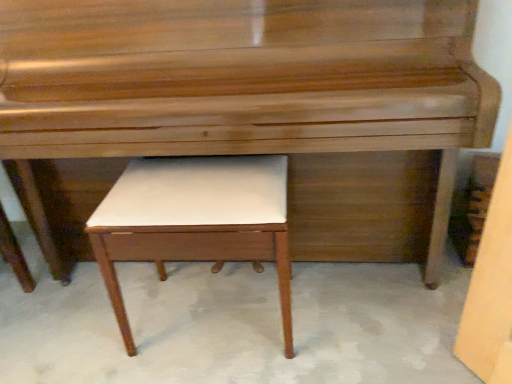
You are a GUI agent. You are given a task and a screenshot of the screen. Output one action in this format:
    pyautogui.click(x=<x>, y=<y>)
    Task: Click on the vacant area that lies between white leather stool at center and glossy wood piano at center
    This screenshot has height=384, width=512.
    Given the screenshot: What is the action you would take?
    pyautogui.click(x=242, y=331)